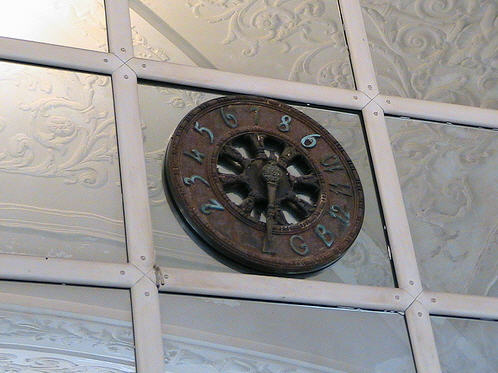
Find the location of a particular element. The width and height of the screenshot is (498, 373). mirror is located at coordinates (90, 189), (164, 251), (188, 355), (18, 323), (475, 345), (429, 232), (424, 87), (266, 48), (71, 24).